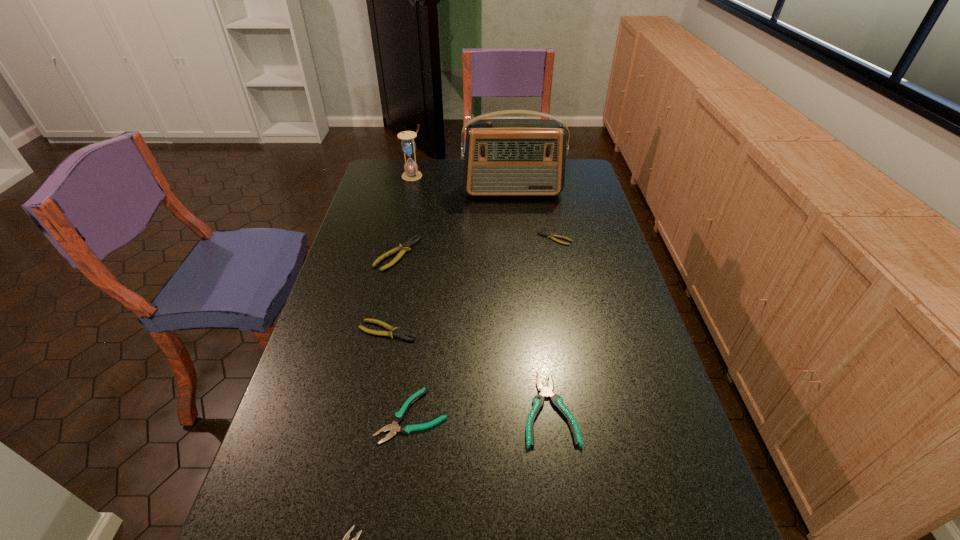
Identify the location of the smallest yellow pliers. This screenshot has width=960, height=540. (551, 236).

This screenshot has height=540, width=960. What are the coordinates of `vacant point located on the front-facing side of the seventh nearest object` in the screenshot? It's located at (515, 210).

At what (x,y) coordinates should I click in order to perform the action: click on vacant space situated on the front of the hourglass. Please return your answer as a coordinate pair (x, y). Looking at the image, I should click on (400, 229).

I want to click on free spot located 0.190m on the front of the third tallest object, so click(384, 316).

Where is `vacant area situated on the left of the biggest teal pliers`? vacant area situated on the left of the biggest teal pliers is located at coordinates (410, 408).

At what (x,y) coordinates should I click in order to perform the action: click on free spot located 0.120m on the back of the fourth nearest object. Please return your answer as a coordinate pair (x, y). The image size is (960, 540). Looking at the image, I should click on (396, 291).

You are a GUI agent. You are given a task and a screenshot of the screen. Output one action in this format:
    pyautogui.click(x=<x>, y=<y>)
    Task: Click on the vacant space located on the right of the second biggest teal pliers
    Image resolution: width=960 pixels, height=540 pixels.
    Given the screenshot: What is the action you would take?
    pyautogui.click(x=580, y=416)

Locate an element on the screen. The image size is (960, 540). vacant space located on the front of the smallest yellow pliers is located at coordinates (559, 257).

Find the location of a particular element. radio receiver located in the far edge section of the desktop is located at coordinates (503, 157).

Where is `hourglass that is at the far edge`? This screenshot has height=540, width=960. hourglass that is at the far edge is located at coordinates (408, 145).